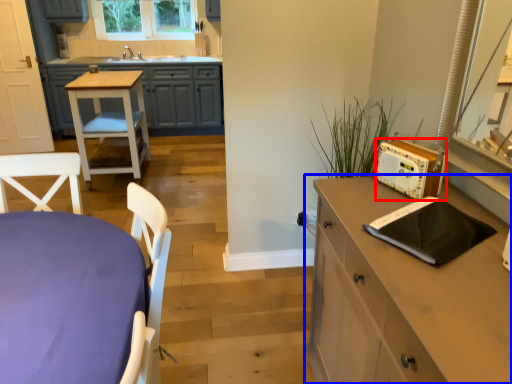
Question: Which point is further to the camera, appliance (highlighted by a red box) or chest of drawers (highlighted by a blue box)?

Choices:
 (A) appliance
 (B) chest of drawers

Answer: (A)